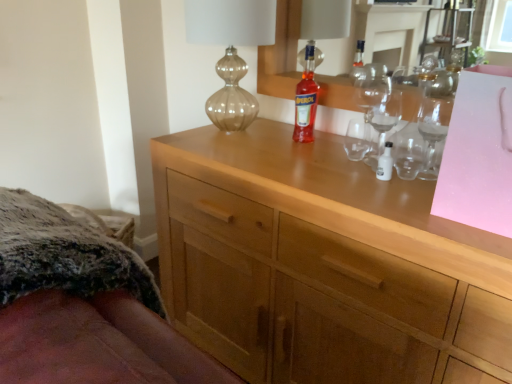
You are a GUI agent. You are given a task and a screenshot of the screen. Output one action in this format:
    pyautogui.click(x=<x>, y=<y>)
    Task: Click on the vacant area that lies between translucent glass vase at upper center and transparent glass wine glass at upper right
    Image resolution: width=512 pixels, height=384 pixels.
    Given the screenshot: What is the action you would take?
    pyautogui.click(x=312, y=150)